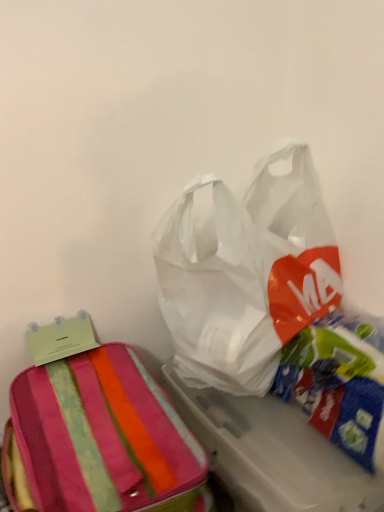
What do you see at coordinates (102, 439) in the screenshot? I see `striped fabric suitcase at left` at bounding box center [102, 439].

What is the approximate height of striped fabric suitcase at left?

11.21 inches.

Locate an element on the screen. This screenshot has width=384, height=512. striped fabric suitcase at left is located at coordinates (102, 439).

What is the approximate height of transparent plastic bag at upper right?

transparent plastic bag at upper right is 40.62 centimeters tall.

Looking at this image, in order to face transparent plastic bag at upper right, should I rotate leftwards or rightwards?

A 8.662 degree turn to the right will do.

Where is `transparent plastic bag at upper right`? transparent plastic bag at upper right is located at coordinates (245, 272).

The image size is (384, 512). Describe the element at coordinates (245, 272) in the screenshot. I see `transparent plastic bag at upper right` at that location.

Where is `striped fabric suitcase at left`? The height and width of the screenshot is (512, 384). striped fabric suitcase at left is located at coordinates (102, 439).

Considering the relative positions of transparent plastic bag at upper right and striped fabric suitcase at left in the image provided, is transparent plastic bag at upper right to the left or to the right of striped fabric suitcase at left?

In the image, transparent plastic bag at upper right appears on the right side of striped fabric suitcase at left.

Which object is closer to the camera taking this photo, transparent plastic bag at upper right or striped fabric suitcase at left?

striped fabric suitcase at left is more forward.

Considering the points (312, 292) and (148, 426), which point is in front, point (312, 292) or point (148, 426)?

The point (148, 426) is closer.

Consider the image. From the image's perspective, is transparent plastic bag at upper right above or below striped fabric suitcase at left?

From the image's perspective, transparent plastic bag at upper right appears above striped fabric suitcase at left.

From a real-world perspective, which is physically above, transparent plastic bag at upper right or striped fabric suitcase at left?

transparent plastic bag at upper right is physically above.

Does transparent plastic bag at upper right have a lesser width compared to striped fabric suitcase at left?

Yes, transparent plastic bag at upper right is thinner than striped fabric suitcase at left.

Who is taller, transparent plastic bag at upper right or striped fabric suitcase at left?

transparent plastic bag at upper right is taller.

Considering the relative sizes of transparent plastic bag at upper right and striped fabric suitcase at left in the image provided, is transparent plastic bag at upper right bigger than striped fabric suitcase at left?

Correct, transparent plastic bag at upper right is larger in size than striped fabric suitcase at left.

Is transparent plastic bag at upper right not inside striped fabric suitcase at left?

Yes, transparent plastic bag at upper right is located beyond the bounds of striped fabric suitcase at left.

Is transparent plastic bag at upper right not close to striped fabric suitcase at left?

Actually, transparent plastic bag at upper right and striped fabric suitcase at left are a little close together.

Is transparent plastic bag at upper right oriented away from striped fabric suitcase at left?

No, striped fabric suitcase at left is not at the back of transparent plastic bag at upper right.

Can you tell me how much transparent plastic bag at upper right and striped fabric suitcase at left differ in facing direction?

0.000512 degrees.

How distant is transparent plastic bag at upper right from striped fabric suitcase at left?

transparent plastic bag at upper right and striped fabric suitcase at left are 21.04 centimeters apart.

The height and width of the screenshot is (512, 384). Identify the location of plastic bag on the right of striped fabric suitcase at left. pyautogui.click(x=245, y=272).

Considering the positions of objects striped fabric suitcase at left and transparent plastic bag at upper right in the image provided, who is more to the right, striped fabric suitcase at left or transparent plastic bag at upper right?

transparent plastic bag at upper right.

Does striped fabric suitcase at left lie in front of transparent plastic bag at upper right?

That is True.

Is point (114, 367) farther from viewer compared to point (287, 174)?

No, it is not.

From the image's perspective, relative to transparent plastic bag at upper right, is striped fabric suitcase at left above or below?

From the image's perspective, striped fabric suitcase at left appears below transparent plastic bag at upper right.

From a real-world perspective, is striped fabric suitcase at left positioned under transparent plastic bag at upper right based on gravity?

Yes, from a real-world perspective, striped fabric suitcase at left is beneath transparent plastic bag at upper right.

Between striped fabric suitcase at left and transparent plastic bag at upper right, which one has larger width?

With larger width is striped fabric suitcase at left.

Which of these two, striped fabric suitcase at left or transparent plastic bag at upper right, stands taller?

With more height is transparent plastic bag at upper right.

In terms of size, does striped fabric suitcase at left appear bigger or smaller than transparent plastic bag at upper right?

Clearly, striped fabric suitcase at left is smaller in size than transparent plastic bag at upper right.

Is striped fabric suitcase at left outside of transparent plastic bag at upper right?

striped fabric suitcase at left is positioned outside transparent plastic bag at upper right.

Looking at this image, is striped fabric suitcase at left next to transparent plastic bag at upper right?

striped fabric suitcase at left and transparent plastic bag at upper right are clearly separated.

Is striped fabric suitcase at left looking in the opposite direction of transparent plastic bag at upper right?

No.

How many degrees apart are the facing directions of striped fabric suitcase at left and transparent plastic bag at upper right?

They differ by 0.000512 degrees in their facing directions.

The width and height of the screenshot is (384, 512). Find the location of `plastic bag that is behind the striped fabric suitcase at left`. plastic bag that is behind the striped fabric suitcase at left is located at coordinates (245, 272).

The height and width of the screenshot is (512, 384). I want to click on plastic bag that is on the right side of striped fabric suitcase at left, so click(245, 272).

You are a GUI agent. You are given a task and a screenshot of the screen. Output one action in this format:
    pyautogui.click(x=<x>, y=<y>)
    Task: Click on the luggage and bags below the transparent plastic bag at upper right (from a real-world perspective)
    The width and height of the screenshot is (384, 512).
    Given the screenshot: What is the action you would take?
    pyautogui.click(x=102, y=439)